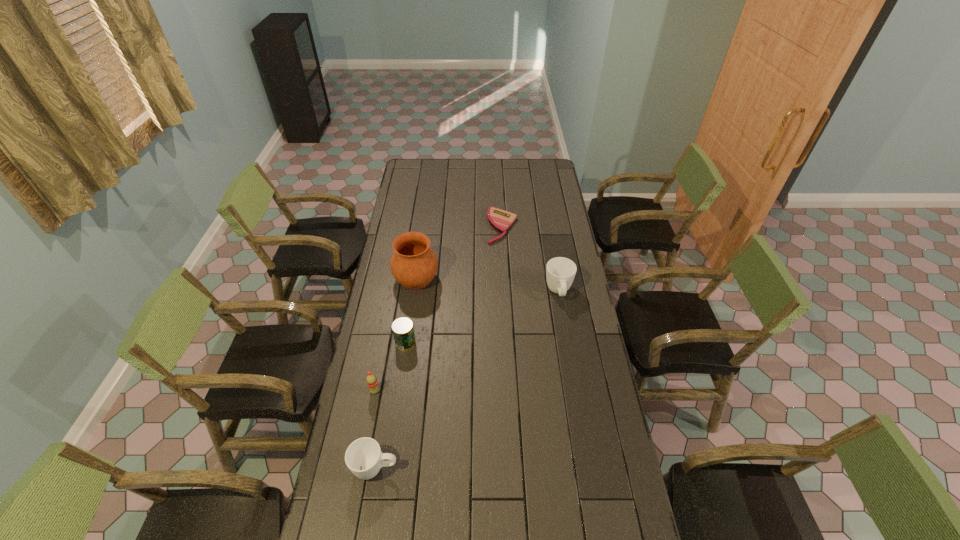
The image size is (960, 540). I want to click on free spot between the nearer cup and the tallest object, so click(x=396, y=374).

Where is `vacant region between the second nearest object and the fourth farthest object`? Image resolution: width=960 pixels, height=540 pixels. vacant region between the second nearest object and the fourth farthest object is located at coordinates (390, 367).

Identify the location of free space between the can and the soda. Image resolution: width=960 pixels, height=540 pixels. (390, 367).

The height and width of the screenshot is (540, 960). What are the coordinates of `free point between the farther cup and the nearest object` in the screenshot? It's located at (468, 381).

The height and width of the screenshot is (540, 960). I want to click on the closest object to the farther cup, so click(x=500, y=220).

At what (x,y) coordinates should I click in order to perform the action: click on object that is the third closest to the pottery. Please return your answer as a coordinate pair (x, y). Image resolution: width=960 pixels, height=540 pixels. Looking at the image, I should click on (371, 380).

Identify the location of vacant space that satisfies the following two spatial constraints: 1. on the back side of the shortest object; 2. on the left side of the soda. This screenshot has width=960, height=540. [406, 226].

You are a GUI agent. You are given a task and a screenshot of the screen. Output one action in this format:
    pyautogui.click(x=<x>, y=<y>)
    Task: Click on the vacant space that satisfies the following two spatial constraints: 1. on the back side of the fifth object from left to right; 2. on the left side of the pottery
    This screenshot has height=540, width=960.
    Given the screenshot: What is the action you would take?
    pyautogui.click(x=423, y=226)

Where is `free space that satisfies the following two spatial constraints: 1. on the back side of the can; 2. on the left side of the farthest object`? The image size is (960, 540). free space that satisfies the following two spatial constraints: 1. on the back side of the can; 2. on the left side of the farthest object is located at coordinates (422, 226).